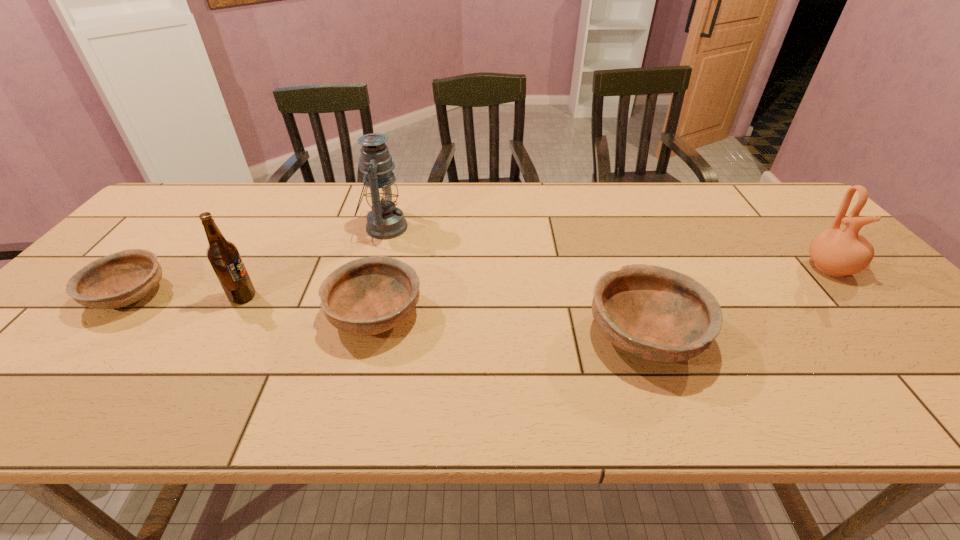
I want to click on the third closest object relative to the pottery, so click(385, 221).

Point out which bowl is positioned as the second nearest to the second object from right to left. Please provide its 2D coordinates. Your answer should be formatted as a tuple, i.e. [(x, y)], where the tuple contains the x and y coordinates of a point satisfying the conditions above.

[(122, 278)]

You are a GUI agent. You are given a task and a screenshot of the screen. Output one action in this format:
    pyautogui.click(x=<x>, y=<y>)
    Task: Click on the bowl that stands as the second closest to the rightmost bowl
    
    Given the screenshot: What is the action you would take?
    pyautogui.click(x=122, y=278)

Locate an element on the screen. free space that satisfies the following two spatial constraints: 1. on the back side of the rightmost bowl; 2. on the label of the second object from left to right is located at coordinates (631, 297).

You are a GUI agent. You are given a task and a screenshot of the screen. Output one action in this format:
    pyautogui.click(x=<x>, y=<y>)
    Task: Click on the vacant point that satisfies the following two spatial constraints: 1. on the front side of the fifth object from left to right; 2. on the left side of the second shortest object
    This screenshot has height=540, width=960.
    Given the screenshot: What is the action you would take?
    pyautogui.click(x=371, y=335)

Identify the location of vacant point that satisfies the following two spatial constraints: 1. on the back side of the second object from right to left; 2. on the label of the beer bottle. (631, 297).

The image size is (960, 540). I want to click on free location that satisfies the following two spatial constraints: 1. on the label of the fifth object from right to left; 2. on the left side of the second object from right to left, so click(x=221, y=335).

I want to click on vacant region that satisfies the following two spatial constraints: 1. on the front-facing side of the second bowl from left to right; 2. on the right side of the tallest object, so click(360, 314).